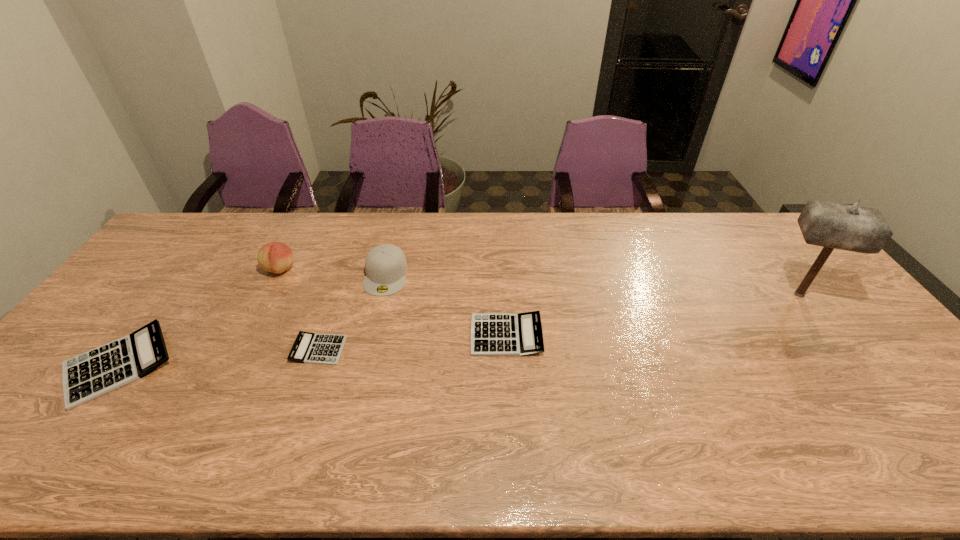
Identify the location of the leftmost calculator. This screenshot has height=540, width=960. pos(87,376).

Where is `the shortest calculator`? the shortest calculator is located at coordinates (310, 348).

Where is `the shortest object`? The height and width of the screenshot is (540, 960). the shortest object is located at coordinates (310, 348).

Where is `the fifth object from left to right`? the fifth object from left to right is located at coordinates click(492, 334).

Find the location of a particular element. The height and width of the screenshot is (540, 960). the second shortest object is located at coordinates (492, 334).

You are a GUI agent. You are given a task and a screenshot of the screen. Output one action in this format:
    pyautogui.click(x=<x>, y=<y>)
    Task: Click on the peach
    The image size is (960, 540).
    Given the screenshot: What is the action you would take?
    pyautogui.click(x=276, y=257)

This screenshot has height=540, width=960. In order to click on the tallest object in this screenshot , I will do `click(831, 225)`.

Locate an element on the screen. This screenshot has height=540, width=960. mallet is located at coordinates (831, 225).

At what (x,y) coordinates should I click in order to perform the action: click on cap. Please return your answer as a coordinate pair (x, y). This screenshot has width=960, height=540. Looking at the image, I should click on (385, 265).

The image size is (960, 540). I want to click on free location located on the right of the leftmost calculator, so click(281, 365).